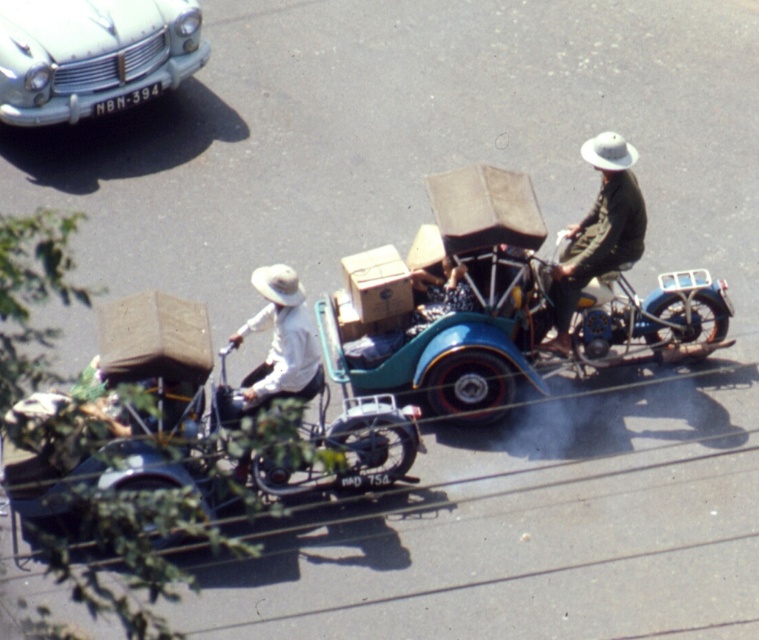
Question: Is shiny chrome motorcycle at center right bigger than green fabric hat at upper right?

Choices:
 (A) yes
 (B) no

Answer: (B)

Question: Which object is the farthest from the white matte hat at center?

Choices:
 (A) green fabric hat at upper right
 (B) shiny chrome motorcycle at center right

Answer: (B)

Question: Can you confirm if green fabric hat at upper right is thinner than white matte hat at center?

Choices:
 (A) yes
 (B) no

Answer: (B)

Question: Does shiny chrome motorcycle at center right appear over white matte hat at center?

Choices:
 (A) yes
 (B) no

Answer: (A)

Question: Which point appears farthest from the camera in this image?

Choices:
 (A) (558, 323)
 (B) (284, 321)
 (C) (694, 273)

Answer: (C)

Question: Which of these objects is positioned farthest from the green fabric hat at upper right?

Choices:
 (A) light blue metallic car at upper left
 (B) white matte hat at center
 (C) shiny chrome motorcycle at center right

Answer: (A)